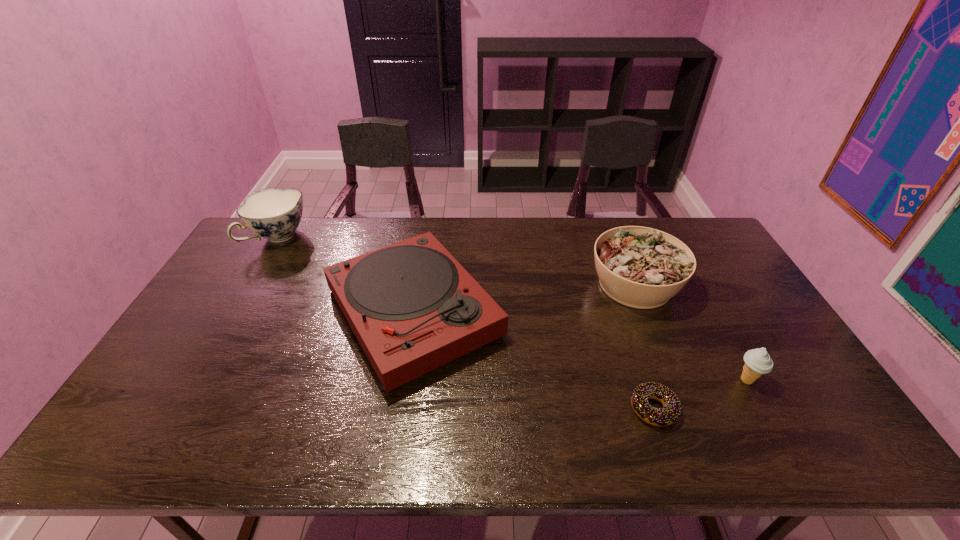
Select which object is the third closest to the second object from left to right. Please provide its 2D coordinates. Your answer should be formatted as a tuple, i.e. [(x, y)], where the tuple contains the x and y coordinates of a point satisfying the conditions above.

[(670, 412)]

This screenshot has width=960, height=540. Identify the location of vacant area in the image that satisfies the following two spatial constraints: 1. on the front side of the salad; 2. on the left side of the icecream. (673, 380).